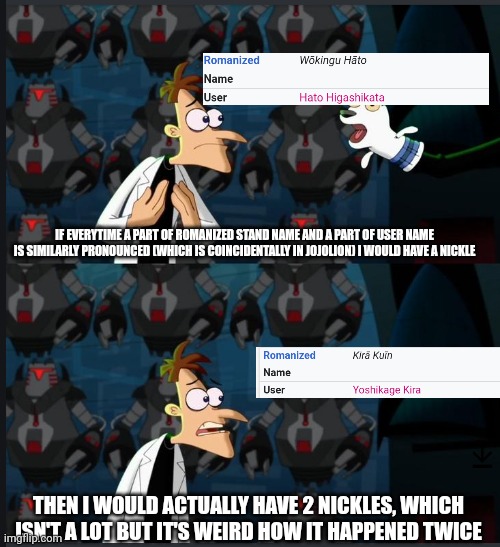
You are a GUI agent. You are given a task and a screenshot of the screen. Output one action in this format:
    pyautogui.click(x=<x>, y=<y>)
    Task: Click on the frame
    The height and width of the screenshot is (547, 500).
    Given the screenshot: What is the action you would take?
    pyautogui.click(x=298, y=162), pyautogui.click(x=212, y=346)